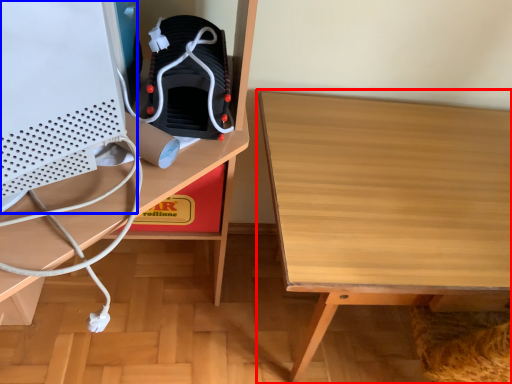
Question: Which point is closer to the camera, table (highlighted by a red box) or desktop computer (highlighted by a blue box)?

Choices:
 (A) table
 (B) desktop computer

Answer: (B)